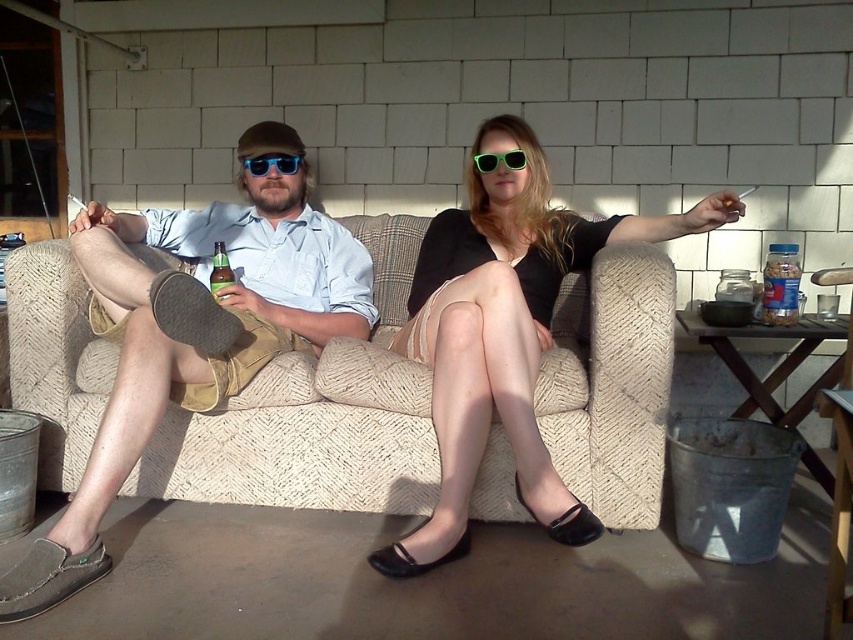
Question: Which object appears farthest from the camera in this image?

Choices:
 (A) matte black dress at center
 (B) green glass bottle at center
 (C) blue reflective sunglasses at center

Answer: (C)

Question: From the image, what is the correct spatial relationship of matte black dress at center in relation to green glass bottle at center?

Choices:
 (A) below
 (B) above

Answer: (A)

Question: Which point is closer to the camera?

Choices:
 (A) matte black dress at center
 (B) beige fabric couch at center

Answer: (A)

Question: Can you confirm if matte black dress at center is thinner than blue reflective sunglasses at center?

Choices:
 (A) yes
 (B) no

Answer: (B)

Question: Which of the following is the farthest from the observer?

Choices:
 (A) (119, 260)
 (B) (485, 157)
 (C) (216, 298)

Answer: (B)

Question: Can you confirm if matte black dress at center is thinner than neon green plastic sunglasses at center?

Choices:
 (A) no
 (B) yes

Answer: (A)